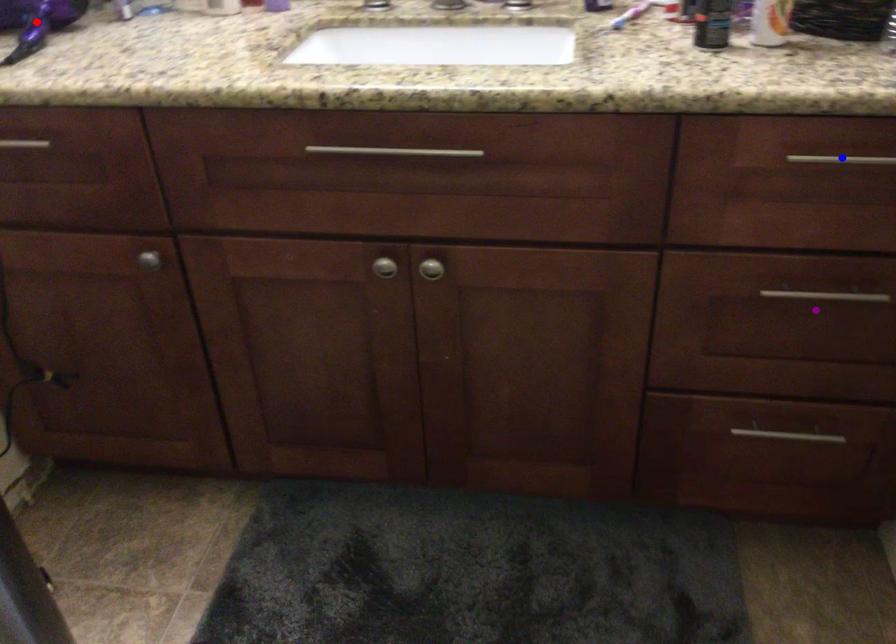
Order these from nearest to farthest:
- purple point
- blue point
- red point

1. red point
2. purple point
3. blue point